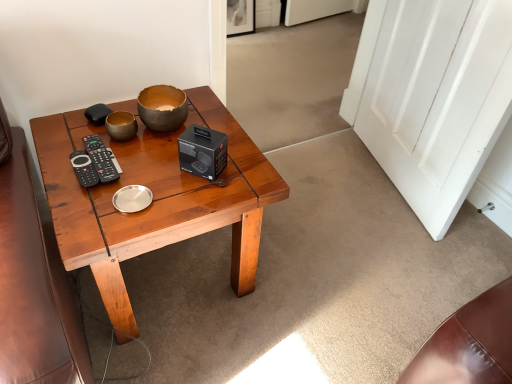
Question: Is matte brown bowl at center smaller than wooden coffee table at center?

Choices:
 (A) no
 (B) yes

Answer: (B)

Question: Is matte brown bowl at center completely or partially outside of wooden coffee table at center?

Choices:
 (A) no
 (B) yes

Answer: (B)

Question: Can you see matte brown bowl at center touching wooden coffee table at center?

Choices:
 (A) yes
 (B) no

Answer: (B)

Question: Is matte brown bowl at center facing away from wooden coffee table at center?

Choices:
 (A) yes
 (B) no

Answer: (B)

Question: Could wooden coffee table at center be considered to be inside matte brown bowl at center?

Choices:
 (A) no
 (B) yes

Answer: (A)

Question: Considering the positions of point (143, 225) and point (98, 167), is point (143, 225) closer or farther from the camera than point (98, 167)?

Choices:
 (A) farther
 (B) closer

Answer: (B)

Question: Based on their sizes in the image, would you say wooden coffee table at center is bigger or smaller than black plastic remote at left?

Choices:
 (A) small
 (B) big

Answer: (B)

Question: From the image's perspective, is wooden coffee table at center located above or below black plastic remote at left?

Choices:
 (A) below
 (B) above

Answer: (A)

Question: From their relative heights in the image, would you say wooden coffee table at center is taller or shorter than black plastic remote at left?

Choices:
 (A) tall
 (B) short

Answer: (A)

Question: In terms of width, does matte brown bowl at center look wider or thinner when compared to black plastic remote at left?

Choices:
 (A) wide
 (B) thin

Answer: (B)

Question: Does point [x=141, y=92] appear closer or farther from the camera than point [x=95, y=162]?

Choices:
 (A) farther
 (B) closer

Answer: (A)

Question: Relative to black plastic remote at left, is matte brown bowl at center in front or behind?

Choices:
 (A) front
 (B) behind

Answer: (B)

Question: Is matte brown bowl at center to the left or to the right of black plastic remote at left in the image?

Choices:
 (A) right
 (B) left

Answer: (A)

Question: Relative to matte brown bowl at center, is white glossy door at right in front or behind?

Choices:
 (A) front
 (B) behind

Answer: (A)

Question: From the image's perspective, is white glossy door at right above or below matte brown bowl at center?

Choices:
 (A) below
 (B) above

Answer: (B)